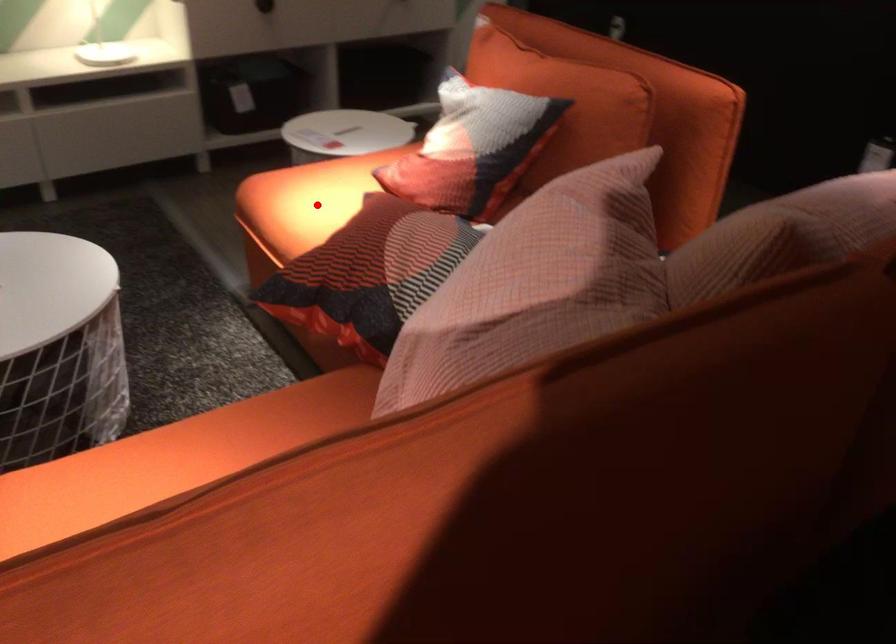
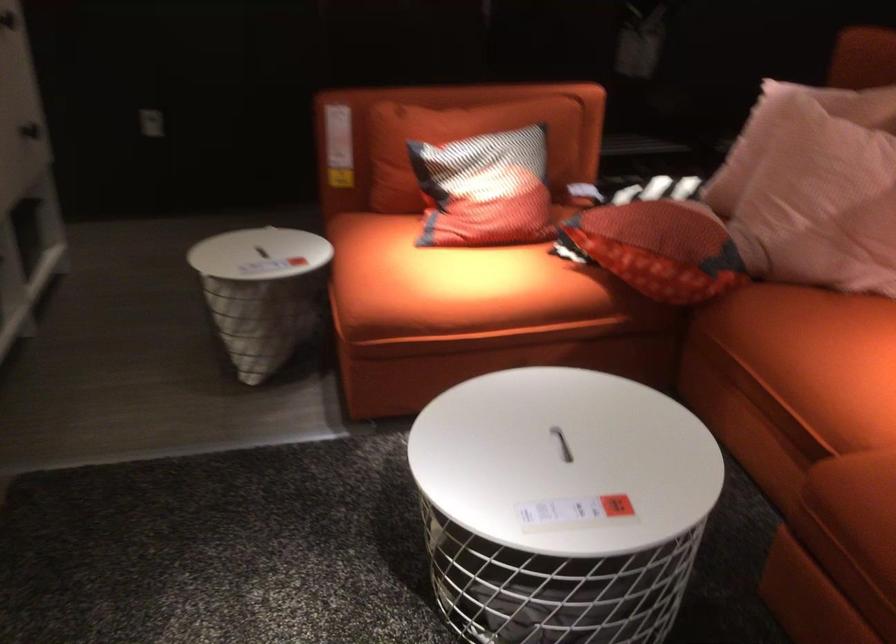
Find the pixel in the second image that matches the highlighted location in the first image.

(449, 281)